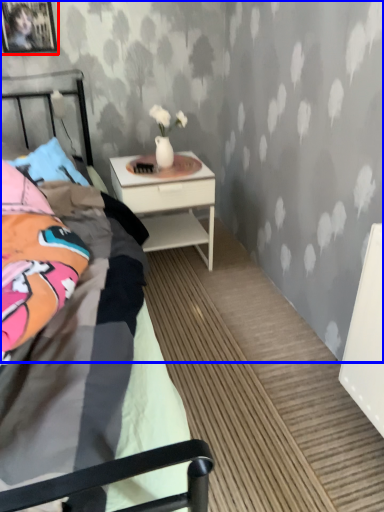
Question: Which object appears closest to the camera in this image, picture frame (highlighted by a red box) or backdrop (highlighted by a blue box)?

Choices:
 (A) picture frame
 (B) backdrop

Answer: (B)